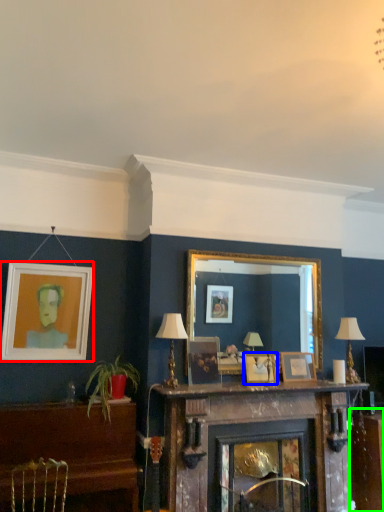
Question: Estimate the real-world distances between objects in this image. Which object is farther from picture frame (highlighted by a red box), picture frame (highlighted by a blue box) or table (highlighted by a green box)?

Choices:
 (A) picture frame
 (B) table

Answer: (B)